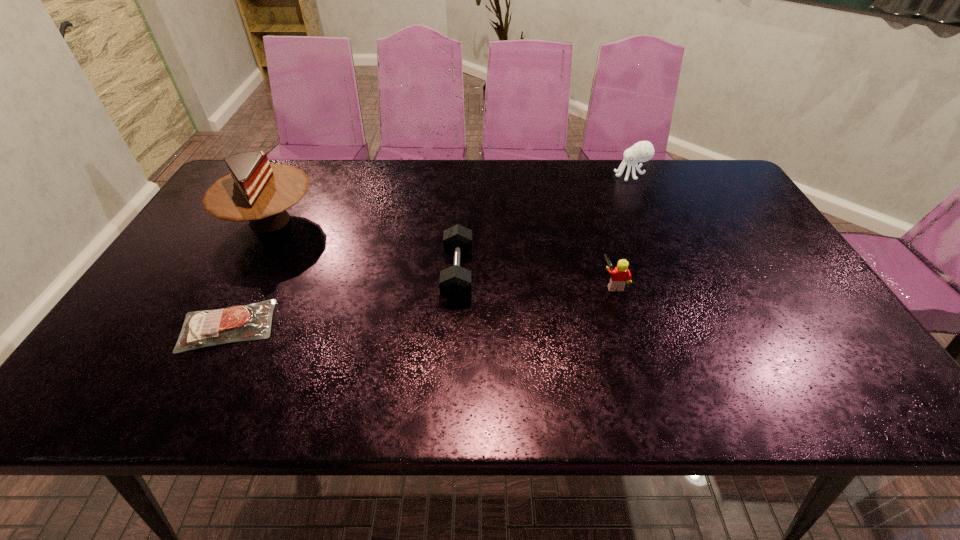
Locate an element on the screen. This screenshot has height=540, width=960. vacant space situated in front of the Lego with the accessory visible is located at coordinates click(486, 284).

The width and height of the screenshot is (960, 540). What are the coordinates of `vacant space located in front of the Lego with the accessory visible` in the screenshot? It's located at (538, 284).

Where is `vacant space situated in front of the Lego with the accessory visible`? The height and width of the screenshot is (540, 960). vacant space situated in front of the Lego with the accessory visible is located at coordinates (554, 284).

Where is `free space located 0.260m on the right of the dumbbell`? Image resolution: width=960 pixels, height=540 pixels. free space located 0.260m on the right of the dumbbell is located at coordinates (573, 274).

This screenshot has height=540, width=960. I want to click on vacant region located on the right of the shortest object, so click(314, 326).

The height and width of the screenshot is (540, 960). In order to click on cake that is at the far edge in this screenshot , I will do `click(256, 191)`.

The width and height of the screenshot is (960, 540). I want to click on octopus located at the far edge, so click(642, 151).

Identify the location of cake present at the left edge. This screenshot has width=960, height=540. (256, 191).

Locate an element on the screen. Image resolution: width=960 pixels, height=540 pixels. steak that is at the left edge is located at coordinates (237, 323).

I want to click on object present at the far left corner, so click(x=256, y=191).